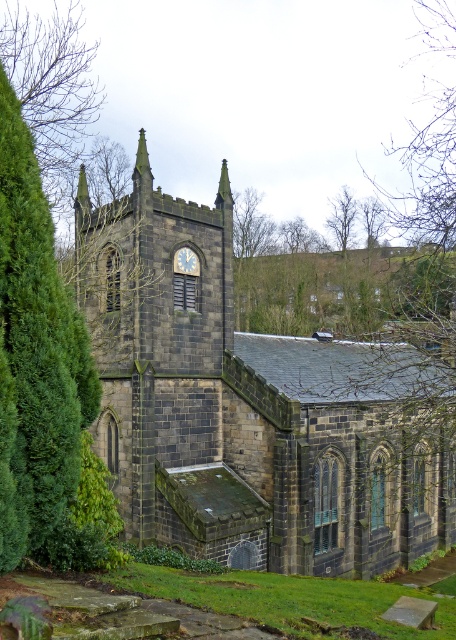
Who is lower down, brown wood tree at upper center or brown textured tree at upper center?

Positioned lower is brown wood tree at upper center.

Is brown wood tree at upper center positioned behind brown textured tree at upper center?

No, brown wood tree at upper center is closer to the viewer.

Which is in front, point (268, 234) or point (330, 216)?

Point (268, 234) is in front.

The image size is (456, 640). I want to click on brown wood tree at upper center, so click(x=252, y=227).

Which is below, dark gray stone church at center or brown wood tree at upper left?

dark gray stone church at center is below.

Does dark gray stone church at center appear under brown wood tree at upper left?

Correct, dark gray stone church at center is located below brown wood tree at upper left.

Who is more distant from viewer, (248,444) or (107,179)?

Point (107,179)

Where is `dark gray stone church at center`? dark gray stone church at center is located at coordinates (243, 408).

You are a GUI agent. You are given a task and a screenshot of the screen. Output one action in this format:
    pyautogui.click(x=<x>, y=<y>)
    Task: Click on the green leafy tree at center
    
    Given the screenshot: What is the action you would take?
    pyautogui.click(x=423, y=324)

Between point (404, 371) and point (114, 177), which one is positioned behind?

Point (114, 177)

Find the location of a particular element. green leafy tree at center is located at coordinates (423, 324).